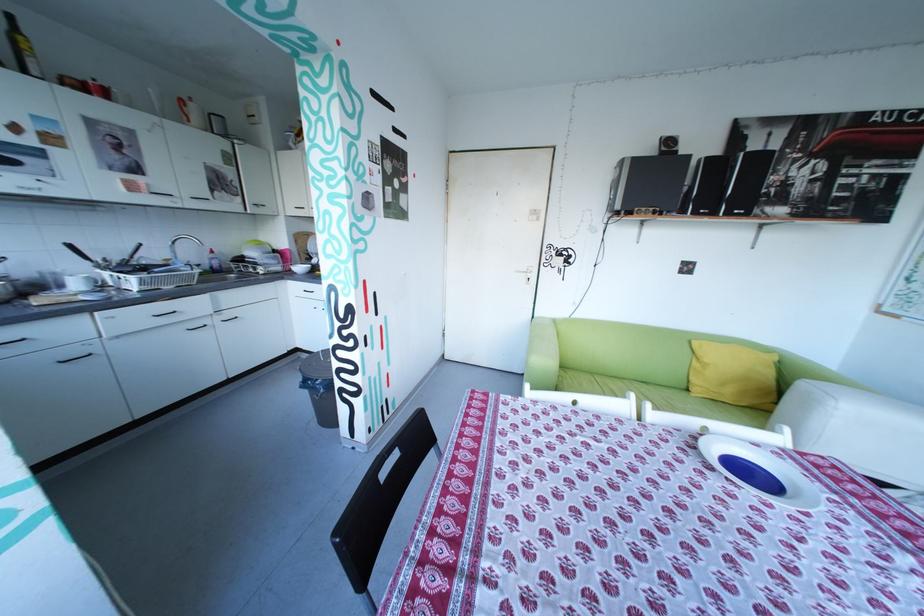
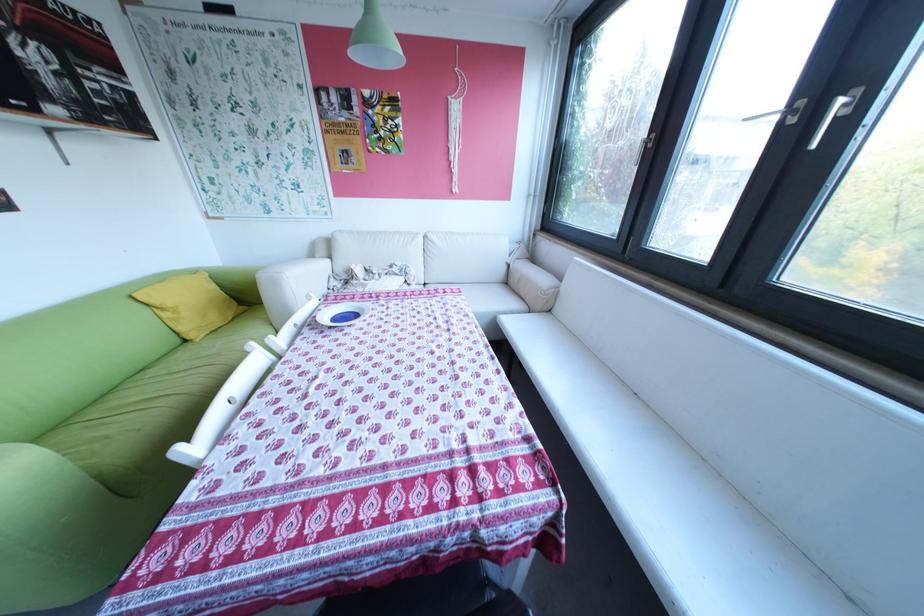
In the second image, find the point that corresponds to (779,350) in the first image.

(207, 270)